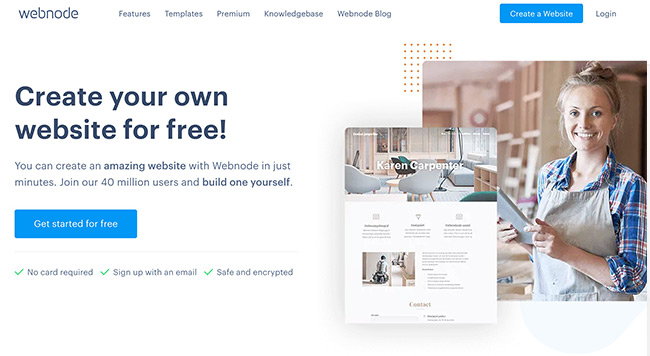
Locate an element on the screen. Image resolution: width=650 pixels, height=356 pixels. white chair is located at coordinates (356, 182), (422, 179).